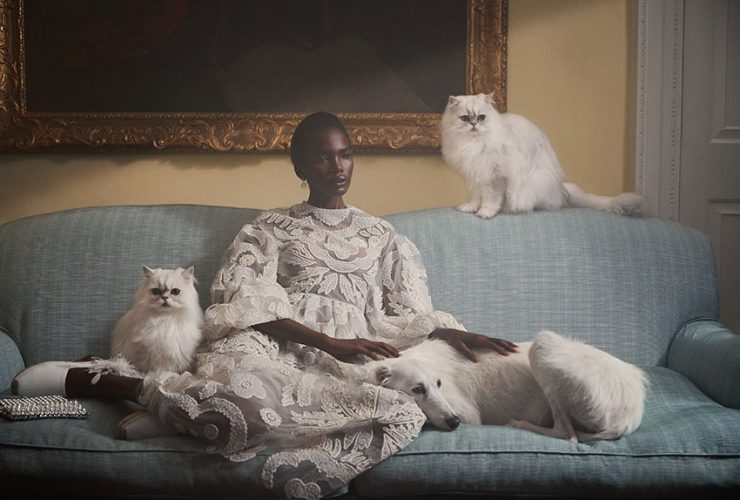
This screenshot has width=740, height=500. What are the coordinates of `arm of settee` in the screenshot? It's located at (716, 338), (10, 349).